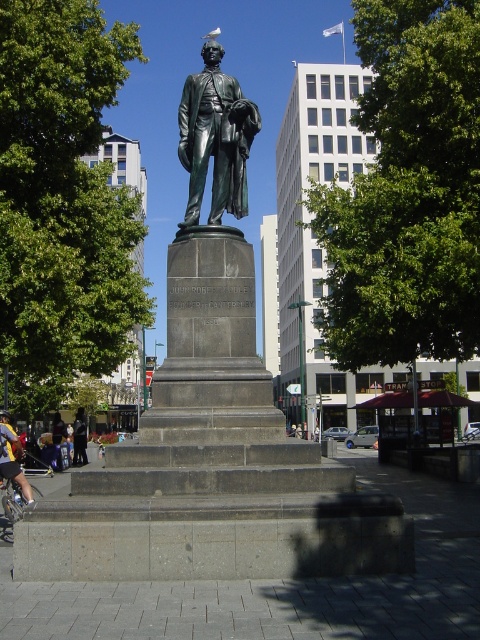
You are standing at the point marked by the coordinates point (12, 460), which is the yellow fabric at lower left. Looking around, you see the statue of a man holding a rolled document on a dark stone pedestal. Can you determine the direction of the statue relative to your current position?

The statue is to your upper right relative to your position at point (12, 460), which is the yellow fabric at lower left.

You are standing at the point with coordinates (216, 138) in the image. What object are you directly facing?

The point at coordinates (216, 138) corresponds to the green bronze statue at center, so you are directly facing the green bronze statue at center.